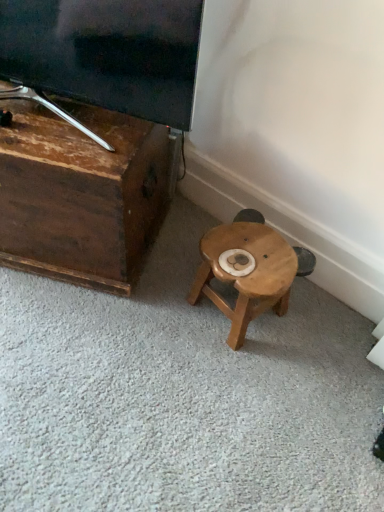
Find the location of `free location above dark brown wood tv stand at left (from a real-world perspective)`. free location above dark brown wood tv stand at left (from a real-world perspective) is located at coordinates (59, 123).